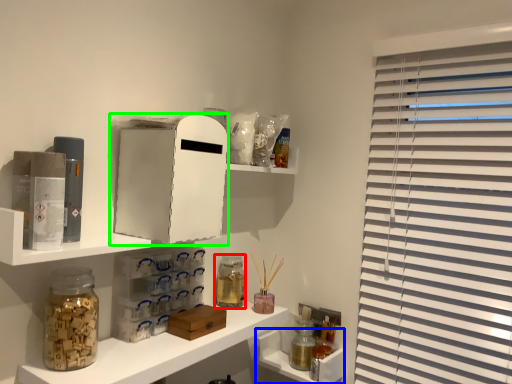
Question: Estimate the real-world distances between objects in this image. Which object is farther from bottle (highlighted by a red box), cabinet (highlighted by a blue box) or medicine cabinet (highlighted by a green box)?

Choices:
 (A) cabinet
 (B) medicine cabinet

Answer: (B)